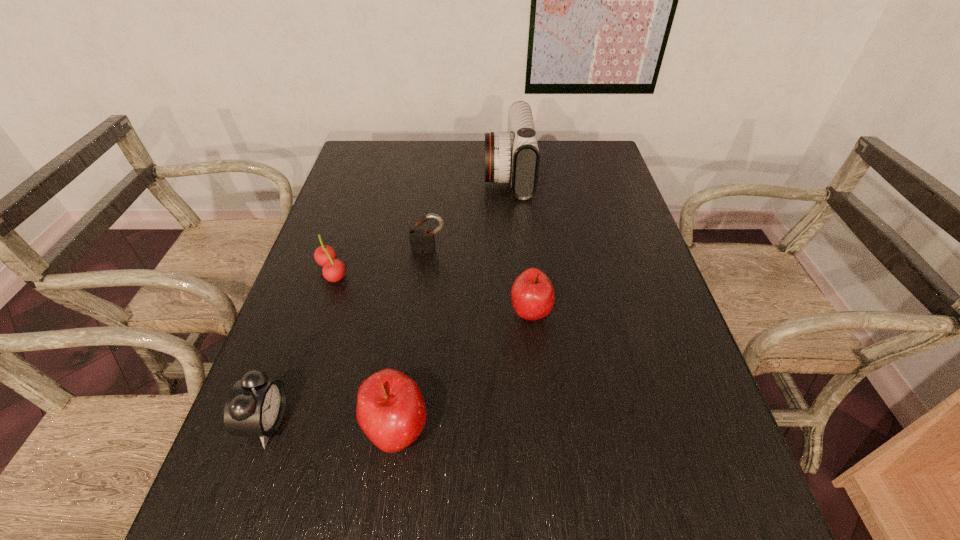
Identify the location of the second tallest object. The width and height of the screenshot is (960, 540). (390, 410).

What are the coordinates of `the taller apple` in the screenshot? It's located at (390, 410).

Where is `the farther apple`? This screenshot has height=540, width=960. the farther apple is located at coordinates (532, 293).

Locate an element on the screen. Image resolution: width=960 pixels, height=540 pixels. the shorter apple is located at coordinates (532, 293).

The width and height of the screenshot is (960, 540). What are the coordinates of `the farthest object` in the screenshot? It's located at (513, 156).

At what (x,y) coordinates should I click in order to perform the action: click on the tallest object. Please return your answer as a coordinate pair (x, y). Image resolution: width=960 pixels, height=540 pixels. Looking at the image, I should click on (513, 156).

At what (x,y) coordinates should I click in order to perform the action: click on alarm clock. Please return your answer as a coordinate pair (x, y). Looking at the image, I should click on (255, 406).

The image size is (960, 540). What are the coordinates of `padlock` in the screenshot? It's located at tap(422, 241).

At what (x,y) coordinates should I click in order to perform the action: click on cherry. Please return your answer as a coordinate pair (x, y). Looking at the image, I should click on (333, 270).

The width and height of the screenshot is (960, 540). Identify the location of the third farthest object. point(333,270).